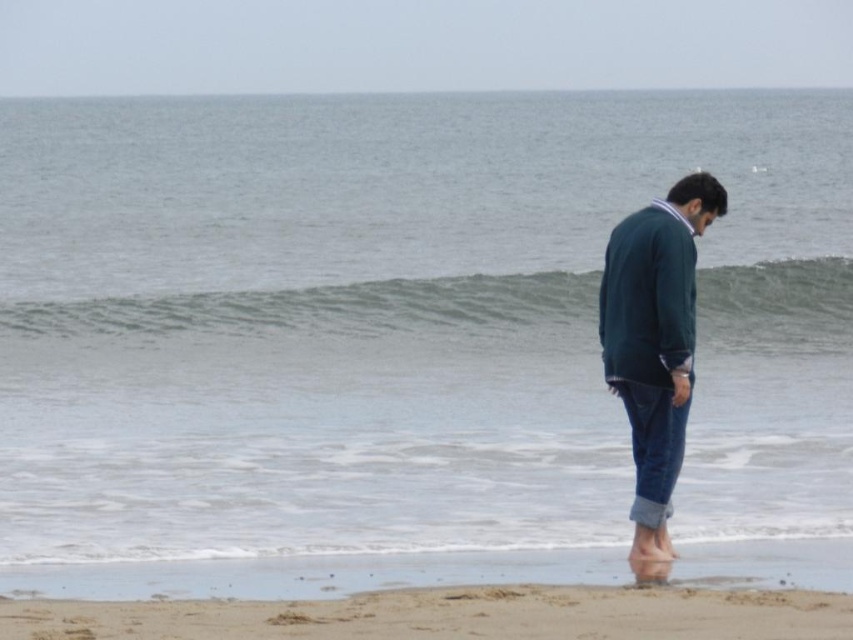
How far apart are green textured wave at center and dark green sweater at center?

green textured wave at center is 8.47 meters from dark green sweater at center.

Can you confirm if green textured wave at center is smaller than dark green sweater at center?

No.

Who is more forward, (775, 332) or (608, 374)?

Point (608, 374) is in front.

Locate an element on the screen. green textured wave at center is located at coordinates (329, 310).

Between point (801, 330) and point (244, 636), which one is positioned in front?

Positioned in front is point (244, 636).

How distant is green textured wave at center from smooth beige sand at lower center?

They are 32.68 feet apart.

At what (x,y) coordinates should I click in order to perform the action: click on green textured wave at center. Please return your answer as a coordinate pair (x, y). The image size is (853, 640). Looking at the image, I should click on (329, 310).

Looking at this image, measure the distance between point (508, 600) and camera.

Point (508, 600) and camera are 8.74 meters apart.

Can you confirm if smooth beige sand at lower center is thinner than dark green sweater at center?

No.

In order to click on smooth beige sand at lower center in this screenshot , I will do `click(450, 616)`.